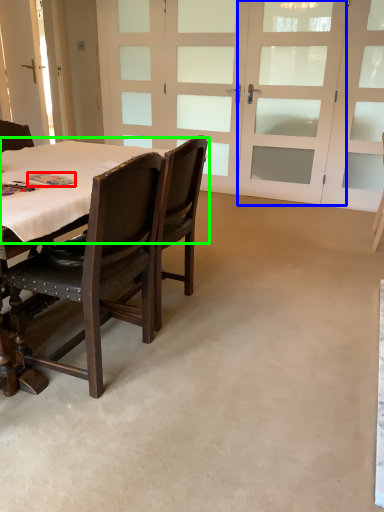
Question: Estimate the real-world distances between objects in this image. Which object is farther from book (highlighted by a red box), screen door (highlighted by a blue box) or table top (highlighted by a green box)?

Choices:
 (A) screen door
 (B) table top

Answer: (A)